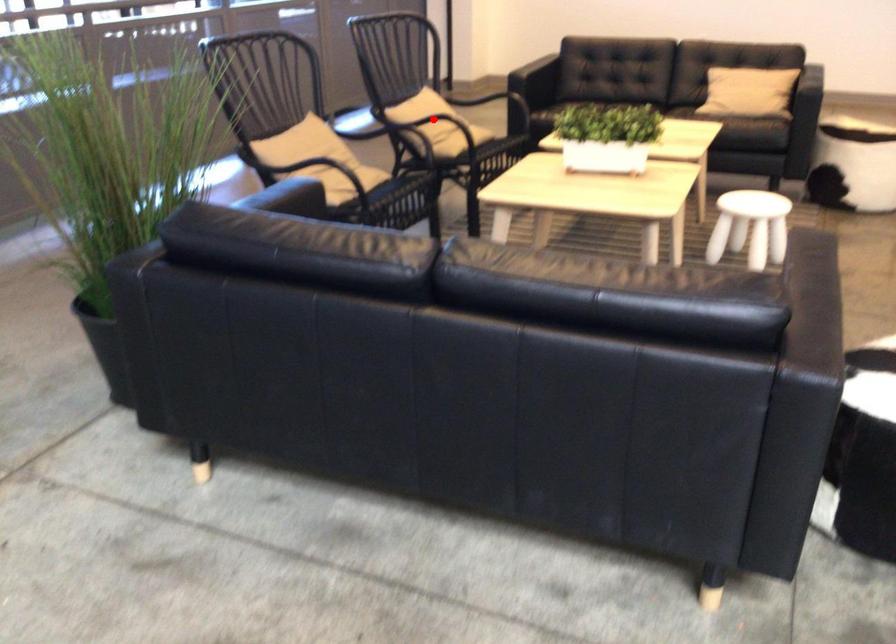
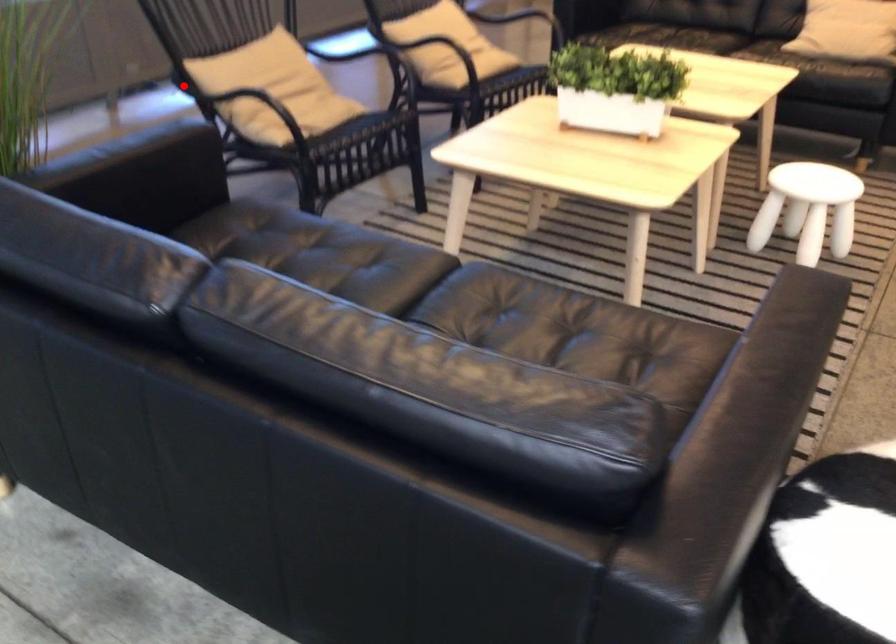
I am providing you with two images of the same scene from different viewpoints. A red point is marked on the first image and another point is marked on the second image. Do the highlighted points in image1 and image2 indicate the same real-world spot?

No